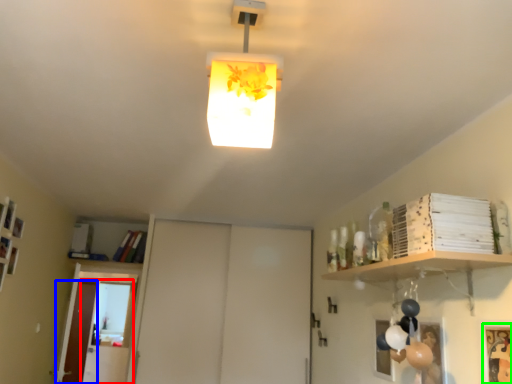
Question: Estimate the real-world distances between objects in this image. Which object is farther from glass door (highlighted by a red box), door (highlighted by a blue box) or picture frame (highlighted by a green box)?

Choices:
 (A) door
 (B) picture frame

Answer: (B)